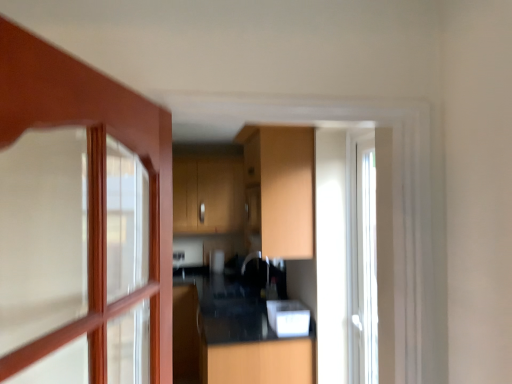
Measure the distance between point (x=266, y=130) and camera.

The distance of point (x=266, y=130) from camera is 2.54 meters.

What do you see at coordinates (282, 187) in the screenshot?
I see `matte wood cabinet at center` at bounding box center [282, 187].

The width and height of the screenshot is (512, 384). What do you see at coordinates (288, 318) in the screenshot? I see `white glossy microwave at center` at bounding box center [288, 318].

What is the approximate height of white glossy microwave at center?

white glossy microwave at center is 15.28 centimeters tall.

This screenshot has width=512, height=384. Identify the location of matte wood cabinet at center. (282, 187).

Relative to white glossy microwave at center, is matte wood cabinet at center in front or behind?

matte wood cabinet at center is in front of white glossy microwave at center.

Is matte wood cabinet at center far away from white glossy microwave at center?

No, there isn't a large distance between matte wood cabinet at center and white glossy microwave at center.

From a real-world perspective, is matte wood cabinet at center physically above white glossy microwave at center?

Yes, from a real-world perspective, matte wood cabinet at center is above white glossy microwave at center.

Is matte wood cabinet at center outside of white glossy microwave at center?

Yes.

Can you tell me how much black glossy counter top at center and matte wood cabinet at center differ in facing direction?

The facing directions of black glossy counter top at center and matte wood cabinet at center are 0.911 degrees apart.

Is point (178, 292) farther from camera compared to point (259, 168)?

Yes, it is.

Considering the sizes of objects black glossy counter top at center and matte wood cabinet at center in the image provided, who is smaller, black glossy counter top at center or matte wood cabinet at center?

matte wood cabinet at center.

You are a GUI agent. You are given a task and a screenshot of the screen. Output one action in this format:
    pyautogui.click(x=<x>, y=<y>)
    Task: Click on the cabinetry on the right of black glossy counter top at center
    This screenshot has width=512, height=384.
    Given the screenshot: What is the action you would take?
    pyautogui.click(x=282, y=187)

Considering the points (298, 322) and (272, 224), which point is behind, point (298, 322) or point (272, 224)?

The point (298, 322) is more distant.

From the image's perspective, is white glossy microwave at center positioned above or below matte wood cabinet at center?

From the image's perspective, white glossy microwave at center appears below matte wood cabinet at center.

From a real-world perspective, does white glossy microwave at center sit lower than matte wood cabinet at center?

Yes, from a real-world perspective, white glossy microwave at center is below matte wood cabinet at center.

Does white glossy microwave at center lie in front of black glossy counter top at center?

No, white glossy microwave at center is further to the viewer.

Does white glossy microwave at center have a greater height compared to black glossy counter top at center?

In fact, white glossy microwave at center may be shorter than black glossy counter top at center.

From a real-world perspective, is white glossy microwave at center positioned above or below black glossy counter top at center?

white glossy microwave at center is above black glossy counter top at center.

Is point (290, 305) less distant than point (279, 372)?

No.

Is point (286, 218) closer to camera compared to point (238, 343)?

Yes.

Is matte wood cabinet at center oriented away from black glossy counter top at center?

No, matte wood cabinet at center is not facing away from black glossy counter top at center.

Do you think matte wood cabinet at center is within black glossy counter top at center, or outside of it?

The correct answer is: outside.

From the image's perspective, which is above, matte wood cabinet at center or black glossy counter top at center?

matte wood cabinet at center appears higher in the image.

Considering the sizes of objects black glossy counter top at center and white glossy microwave at center in the image provided, who is taller, black glossy counter top at center or white glossy microwave at center?

black glossy counter top at center is taller.

Which is farther, [311,363] or [276,303]?

The point [276,303] is farther from the camera.

From the image's perspective, which one is positioned higher, black glossy counter top at center or white glossy microwave at center?

From the image's view, white glossy microwave at center is above.

Locate an element on the screen. cabinetry in front of the white glossy microwave at center is located at coordinates (282, 187).

In order to click on counter top on the left of matte wood cabinet at center in this screenshot , I will do `click(233, 337)`.

From the image, which object appears to be nearer to black glossy counter top at center, white glossy microwave at center or matte wood cabinet at center?

white glossy microwave at center lies closer to black glossy counter top at center than the other object.

Estimate the real-world distances between objects in this image. Which object is closer to white glossy microwave at center, black glossy counter top at center or matte wood cabinet at center?

matte wood cabinet at center is closer to white glossy microwave at center.

Considering their positions, is black glossy counter top at center positioned further to matte wood cabinet at center than white glossy microwave at center?

black glossy counter top at center.

Estimate the real-world distances between objects in this image. Which object is closer to black glossy counter top at center, matte wood cabinet at center or white glossy microwave at center?

white glossy microwave at center is positioned closer to the anchor black glossy counter top at center.

From the image, which object appears to be farther from matte wood cabinet at center, white glossy microwave at center or black glossy counter top at center?

The object further to matte wood cabinet at center is black glossy counter top at center.

Considering their positions, is matte wood cabinet at center positioned further to white glossy microwave at center than black glossy counter top at center?

black glossy counter top at center is further to white glossy microwave at center.

Find the location of a particular element. The image size is (512, 384). appliance that lies between matte wood cabinet at center and black glossy counter top at center from top to bottom is located at coordinates (288, 318).